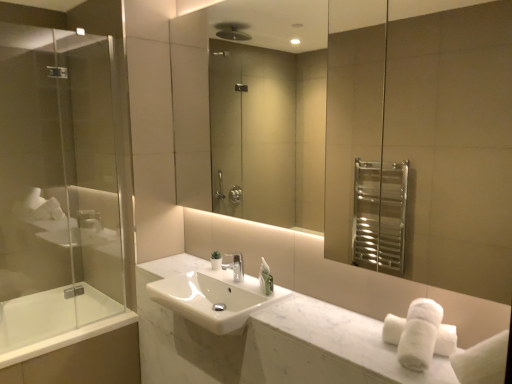
Locate an element on the screen. The height and width of the screenshot is (384, 512). vacant space to the right of silver metallic faucet at center is located at coordinates (248, 282).